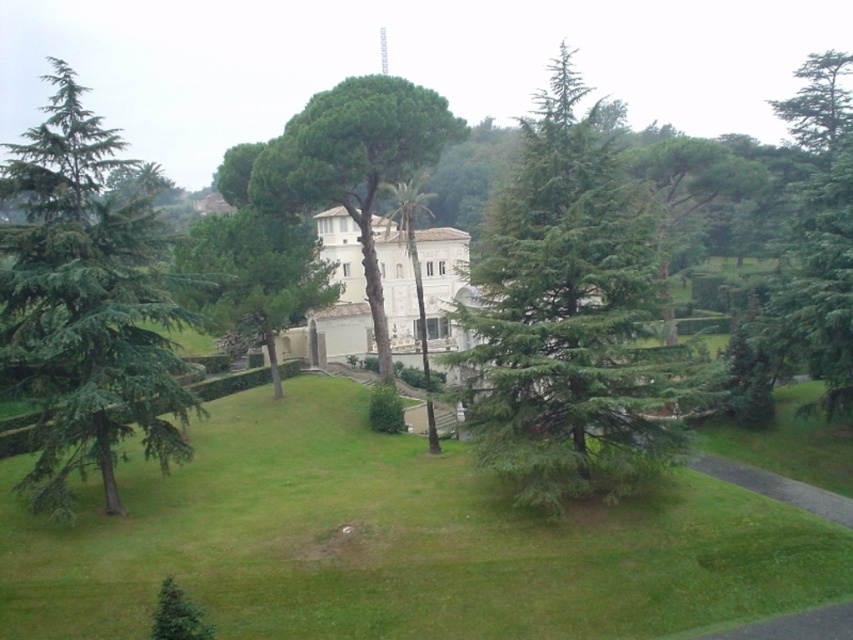
You are a gardener who wants to plant a new flower bed between the green grassy at center and the green leafy tree at center. Considering their heights, which one is shorter and therefore more suitable to place the flower bed in front of?

The green grassy at center is not as tall as the green leafy tree at center, so it is shorter. Therefore, the flower bed should be placed in front of the green grassy at center to ensure visibility.